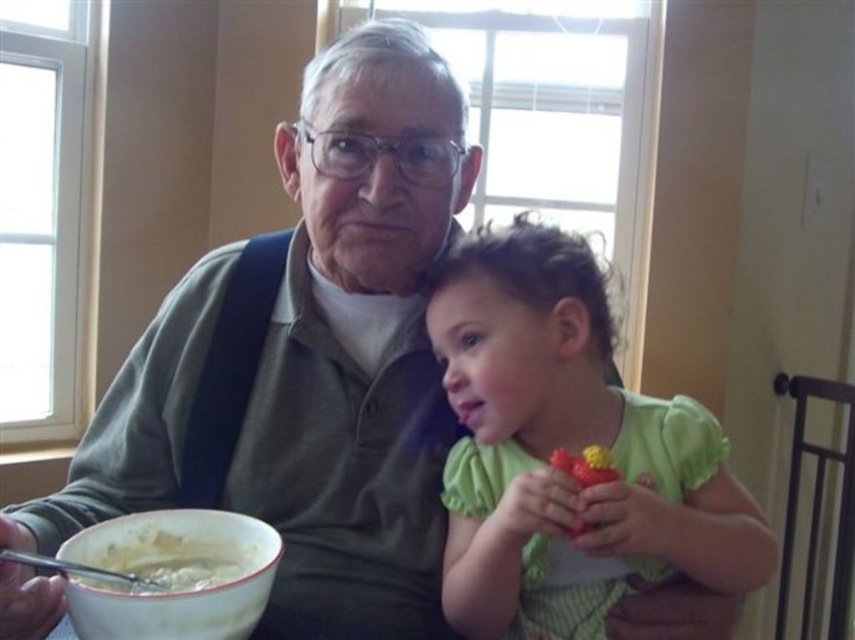
Does white glossy bowl at lower left have a greater height compared to white creamy soup at lower left?

Indeed, white glossy bowl at lower left has a greater height compared to white creamy soup at lower left.

Does point (131, 518) lie behind point (108, 570)?

Yes.

Is point (167, 616) farther from camera compared to point (157, 561)?

That is False.

Identify the location of white glossy bowl at lower left. (174, 576).

Which is below, matte green shirt at center or green fabric toy at right?

Positioned lower is green fabric toy at right.

Who is positioned more to the right, matte green shirt at center or green fabric toy at right?

From the viewer's perspective, green fabric toy at right appears more on the right side.

Between point (367, 627) and point (717, 512), which one is positioned behind?

The point (367, 627) is behind.

The width and height of the screenshot is (855, 640). What are the coordinates of `matte green shirt at center` in the screenshot? It's located at (305, 360).

Measure the distance between matte green shirt at center and white creamy soup at lower left.

matte green shirt at center is 10.23 inches from white creamy soup at lower left.

Who is positioned more to the right, matte green shirt at center or white creamy soup at lower left?

matte green shirt at center

Is point (44, 604) positioned behind point (186, 563)?

No, it is in front of (186, 563).

Locate an element on the screen. matte green shirt at center is located at coordinates (305, 360).